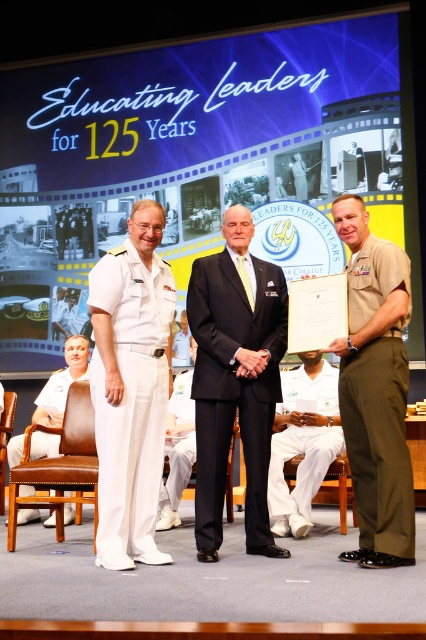
You are an event photographer at the ceremony. You need to capture a photo of the white uniform at left and the white cotton pants at center. Which subject should you focus on first to ensure both are in frame without moving the camera?

The white uniform at left is wider than the white cotton pants at center, so focus on the white uniform at left first to accommodate its larger size within the frame.

Based on the provided image, what are the 2D coordinates of the olive green fabric pants at right?

The 2D coordinates of the olive green fabric pants at right are at point [377,403].

You are standing at the center of the stage and see two points marked on the floor. One is at point (293,412) and the other at point (63,508). Which point is closer to you?

Point (63,508) is closer to you because it is in front of point (293,412).